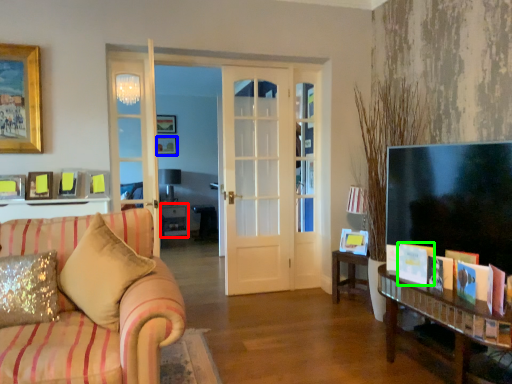
Question: Which object is the closest to the table (highlighted by a red box)? Choose among these: picture frame (highlighted by a blue box) or book (highlighted by a green box).

Choices:
 (A) picture frame
 (B) book

Answer: (A)